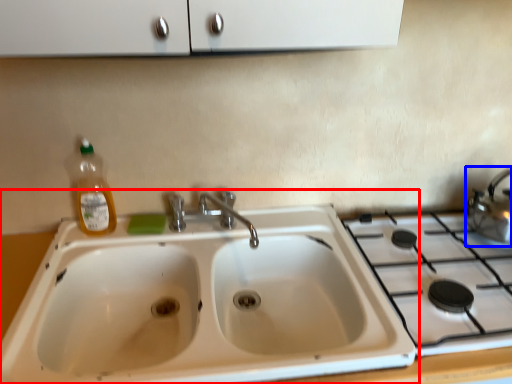
Question: Which point is closer to the camera, sink (highlighted by a red box) or tea pot (highlighted by a blue box)?

Choices:
 (A) sink
 (B) tea pot

Answer: (A)